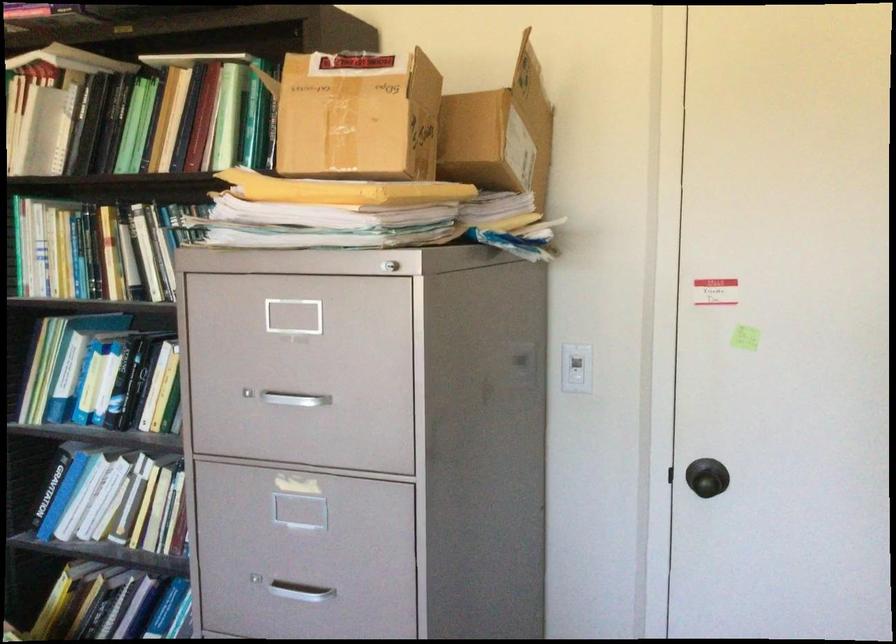
Find the location of `cabinet drawer lock`. cabinet drawer lock is located at coordinates (252, 574).